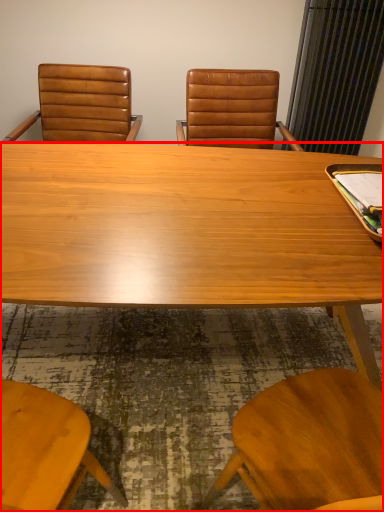
Question: From the image's perspective, where is desk (annotated by the red box) located relative to chair?

Choices:
 (A) above
 (B) below

Answer: (B)